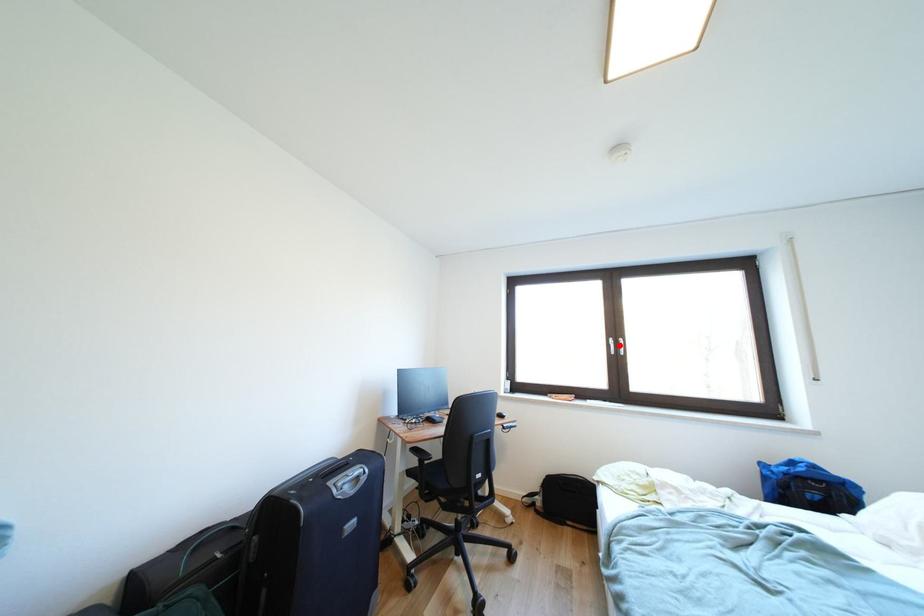
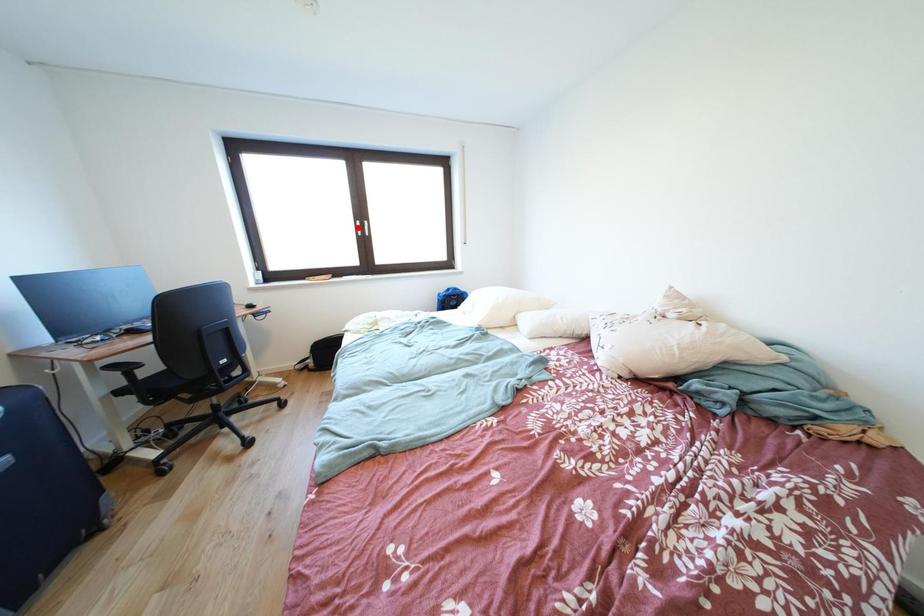
I am providing you with two images of the same scene from different viewpoints. A red point is marked on the first image and another point is marked on the second image. Do the highlighted points in image1 and image2 indicate the same real-world spot?

No